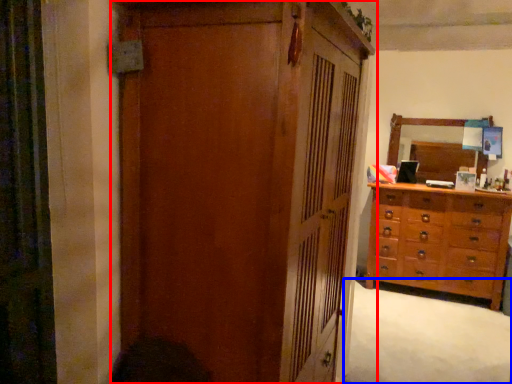
Question: Which object appears farthest to the camera in this image, cupboard (highlighted by a red box) or plain (highlighted by a blue box)?

Choices:
 (A) cupboard
 (B) plain

Answer: (B)